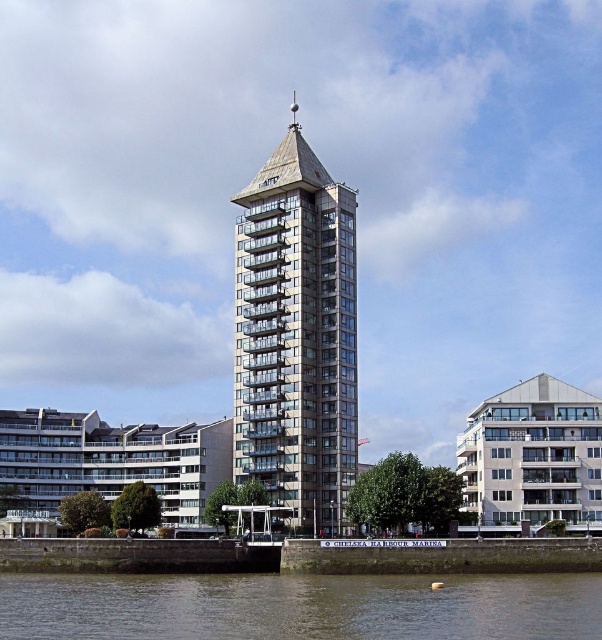
You are a drone operator trying to capture a photo of the metallic glass tower at center and brown water at lower center. To ensure both are visible in the frame, you need to adjust your altitude. Based on their relative heights, what should you consider about the tower and the water?

The metallic glass tower at center is taller than the brown water at lower center. To capture both in the frame, you should position the drone at an altitude where the tower doesn not block the view of the water, ensuring the water remains visible below the tower.

You are a drone operator trying to capture the metallic glass tower at center from above. The drone has a camera with a 100mm lens. The tower is located at point coordinates of 0.523, 0.493. To ensure the tower is in the center of the photo, where should you position the drone relative to the tower?

The metallic glass tower at center is located at point coordinates of (296, 333). To center it in the photo, the drone should be positioned directly above the tower at those coordinates.

You are a drone operator tasked with capturing aerial footage of the metallic glass tower at center and the brown water at lower center. From your current position, which object is positioned higher in the frame?

The metallic glass tower at center is located above the brown water at lower center, so it is positioned higher in the frame.